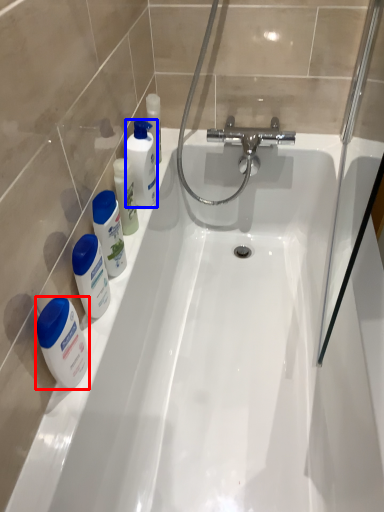
Question: Which point is further to the camera, mouthwash (highlighted by a red box) or cleaning product (highlighted by a blue box)?

Choices:
 (A) mouthwash
 (B) cleaning product

Answer: (B)